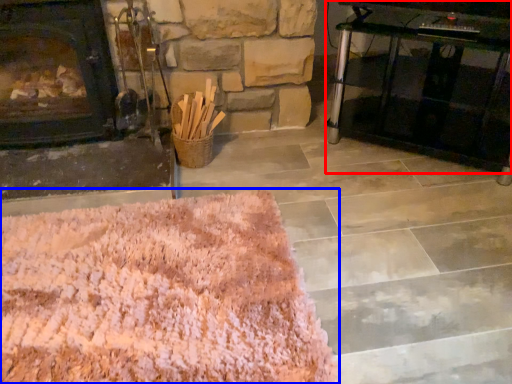
Question: Which of the following is the closest to the observer, table (highlighted by a red box) or mat (highlighted by a blue box)?

Choices:
 (A) table
 (B) mat

Answer: (B)